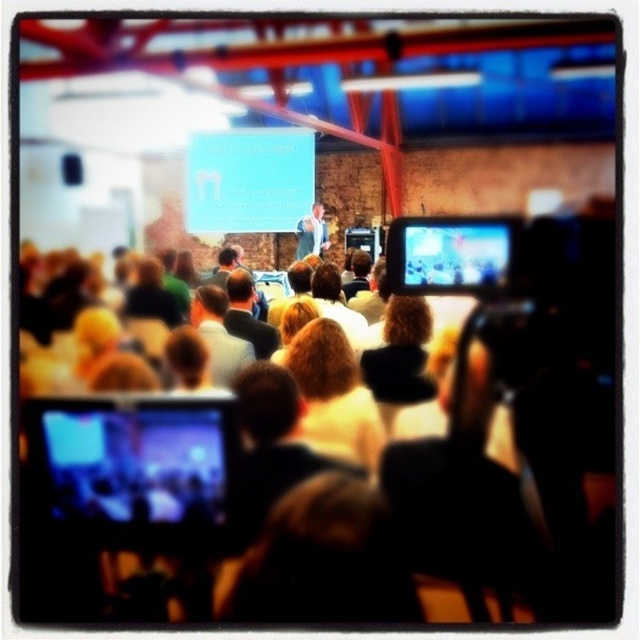
In the conference scene, there is a point marked at coordinates (333, 396). What object or feature is located at this point?

The point at coordinates (333, 396) marks the location of blonde hair at center.

In the scene shown: You are an event photographer at the conference. You want to capture a closeup shot of the two central figures on stage. However, you notice that the blonde hair at center and the light brown leather jacket at center are blocking your view. Which object should you move to get a clearer view of the stage?

You should move the blonde hair at center since it is larger in size compared to the light brown leather jacket at center, making it the bigger obstruction.

You are an attendee at this conference and you see the matte black laptop at upper center and the light brown leather jacket at center. Which object is positioned lower in the image?

The matte black laptop at upper center is positioned below the light brown leather jacket at center, so the laptop is lower than the jacket.